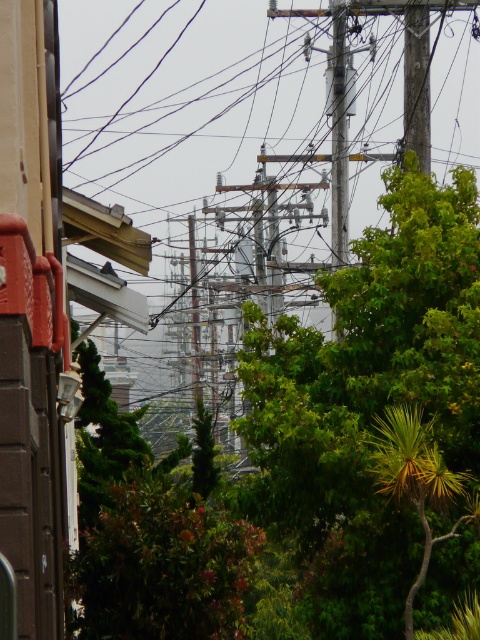
Question: Which point is closer to the camera?

Choices:
 (A) (326, 548)
 (B) (409, 131)
 (C) (408, 602)

Answer: (C)

Question: Is green leafy tree at center further to the viewer compared to wooden at upper center?

Choices:
 (A) no
 (B) yes

Answer: (A)

Question: Estimate the real-world distances between objects in this image. Which object is closer to the yellow-green leafy tree at right?

Choices:
 (A) wooden at upper center
 (B) green leafy tree at center

Answer: (B)

Question: Is green leafy tree at center closer to camera compared to yellow-green leafy tree at right?

Choices:
 (A) yes
 (B) no

Answer: (B)

Question: In this image, where is green leafy tree at center located relative to yellow-green leafy tree at right?

Choices:
 (A) left
 (B) right

Answer: (A)

Question: Which object is positioned closest to the wooden at upper center?

Choices:
 (A) yellow-green leafy tree at right
 (B) green leafy tree at center

Answer: (B)